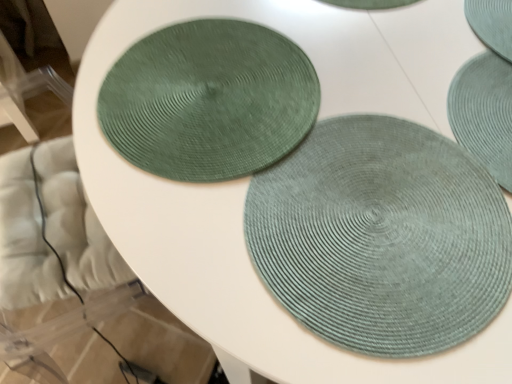
In order to click on free space that is to the left of teal woven coaster at upper right, the first coaster when ordered from right to left in this screenshot , I will do `click(405, 62)`.